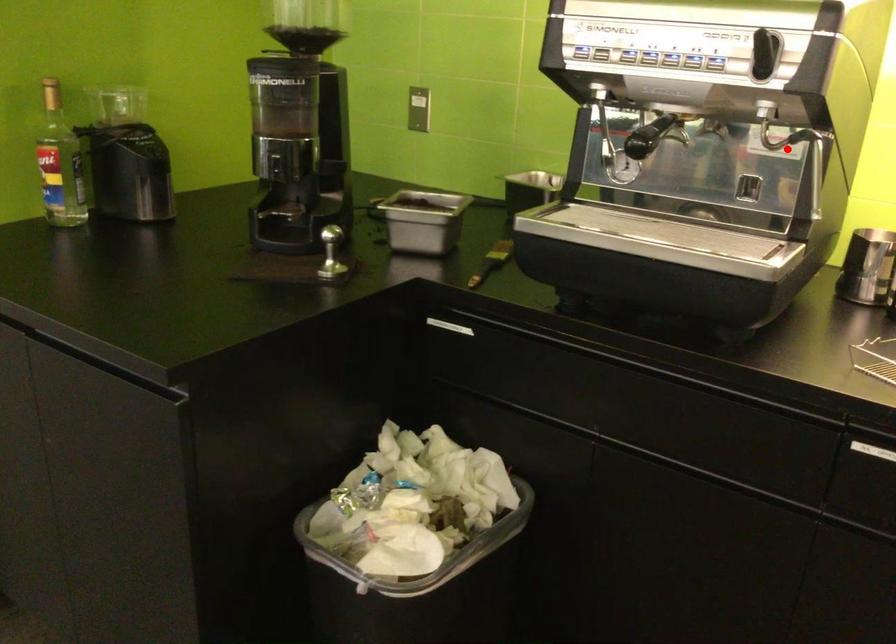
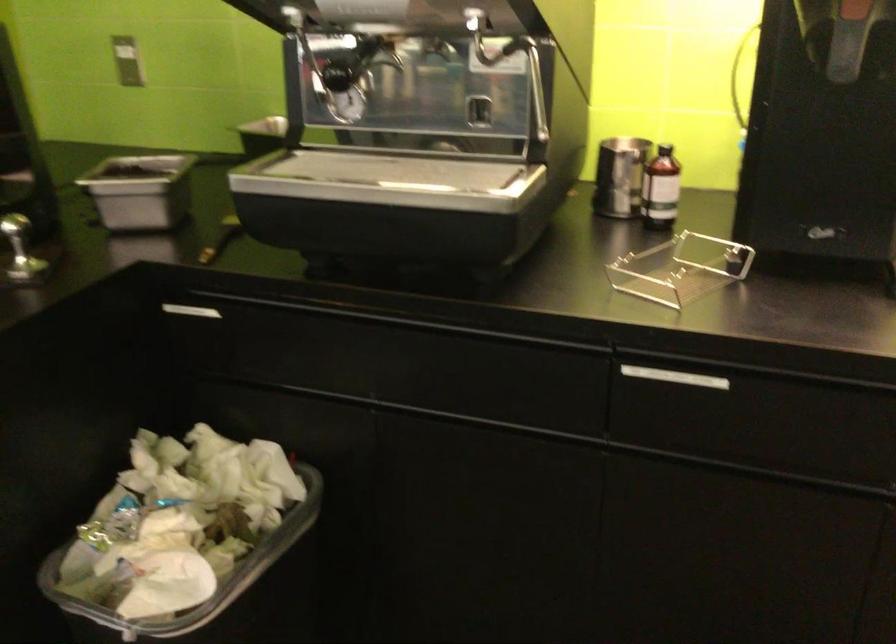
Question: I am providing you with two images of the same scene from different viewpoints. A red point is marked on the first image. At the location where the point appears in image 1, is it still visible in image 2?

Choices:
 (A) Yes
 (B) No

Answer: (A)